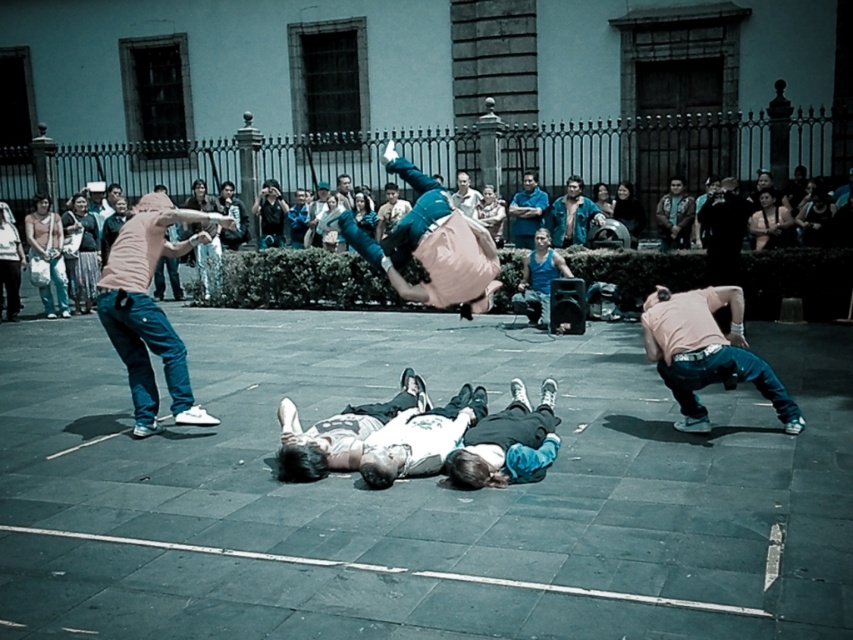
Can you confirm if matte pink shirt at upper center is shorter than light brown leather jacket at center?

No, matte pink shirt at upper center is not shorter than light brown leather jacket at center.

Is matte pink shirt at upper center positioned at the back of light brown leather jacket at center?

No.

This screenshot has height=640, width=853. I want to click on matte pink shirt at upper center, so click(299, 280).

Where is `matte pink shirt at upper center`? matte pink shirt at upper center is located at coordinates (299, 280).

Does point (676, 236) lie in front of point (378, 218)?

That is True.

Can you confirm if denim jacket at upper center is positioned to the right of light brown hair at center?

Indeed, denim jacket at upper center is positioned on the right side of light brown hair at center.

Image resolution: width=853 pixels, height=640 pixels. Identify the location of denim jacket at upper center. (674, 216).

Which of these two, pink fabric at center or smooth black hair at upper center, stands shorter?

pink fabric at center

Identify the location of pink fabric at center. The width and height of the screenshot is (853, 640). (428, 244).

Locate an element on the screen. The width and height of the screenshot is (853, 640). pink fabric at center is located at coordinates (428, 244).